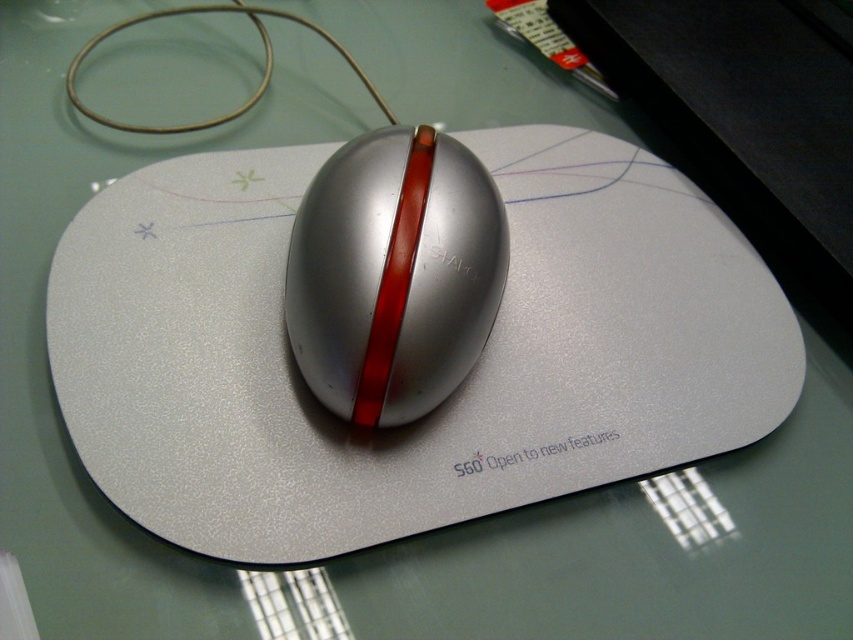
You are sitting at a desk and want to reach the point marked as point (187, 237). Your hand can extend 1.3 meters. Can you reach it?

The distance of point (187, 237) from viewer is 1.34 meters, so your hand can extend 1.3 meters, so you cannot reach it.